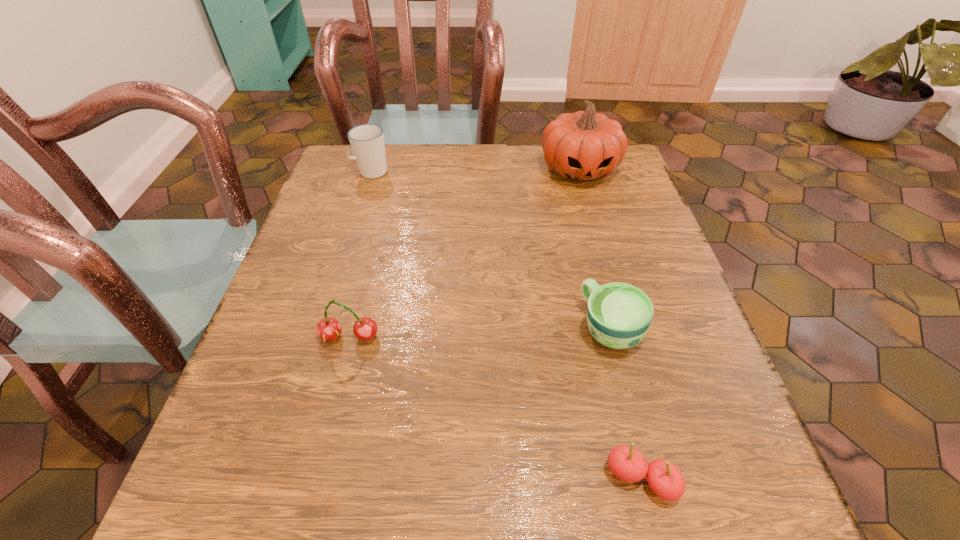
The width and height of the screenshot is (960, 540). In order to click on cherry that is at the right edge in this screenshot , I will do `click(628, 464)`.

This screenshot has height=540, width=960. Identify the location of object that is at the far left corner. (367, 141).

The width and height of the screenshot is (960, 540). What are the coordinates of `object that is at the far right corner` in the screenshot? It's located at (584, 146).

The width and height of the screenshot is (960, 540). Find the location of `object located in the near right corner section of the desktop`. object located in the near right corner section of the desktop is located at coordinates (628, 464).

Identify the location of vacant space at the far edge. This screenshot has height=540, width=960. (520, 188).

Identify the location of vacant region at the near edge of the desktop. (323, 531).

In the image, there is a desktop. Identify the location of free space at the left edge. The height and width of the screenshot is (540, 960). (322, 199).

Identify the location of free space at the right edge of the desktop. (640, 215).

This screenshot has width=960, height=540. I want to click on free region at the far left corner of the desktop, so click(x=369, y=187).

Locate an element on the screen. This screenshot has height=540, width=960. vacant space at the near left corner of the desktop is located at coordinates [x=288, y=498].